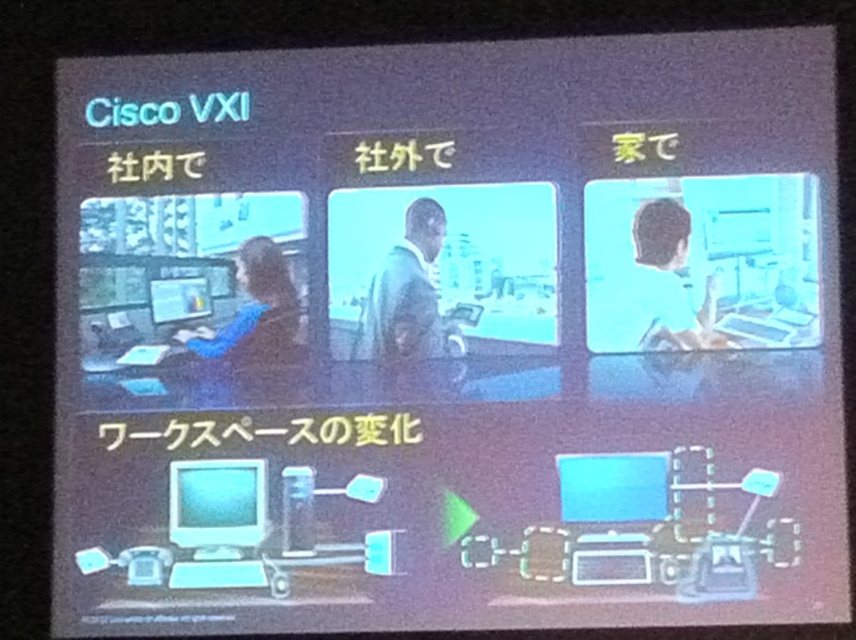
Question: Is matte black person at center bigger than blue matte shirt at center?

Choices:
 (A) no
 (B) yes

Answer: (B)

Question: Which point is farther from the camera taking this photo?

Choices:
 (A) (221, 484)
 (B) (424, 323)
 (C) (182, 280)
 (D) (675, 237)

Answer: (C)

Question: Which of the following is the farthest from the observer?

Choices:
 (A) matte black person at center
 (B) green matte jacket at center
 (C) matte black monitor at center
 (D) white glossy computer monitor at lower left

Answer: (C)

Question: Does white glossy computer monitor at lower left have a larger size compared to blue matte shirt at center?

Choices:
 (A) no
 (B) yes

Answer: (A)

Question: Is matte black person at center positioned before white glossy computer monitor at lower left?

Choices:
 (A) no
 (B) yes

Answer: (A)

Question: Among these objects, which one is farthest from the camera?

Choices:
 (A) white glossy computer monitor at lower left
 (B) green matte jacket at center
 (C) matte black monitor at center

Answer: (C)